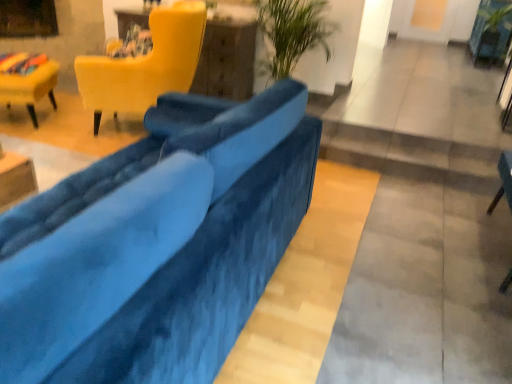
Question: Is green leafy plant at upper right outside of velvet blue chair at lower right, acting as the first chair starting from the right?

Choices:
 (A) yes
 (B) no

Answer: (A)

Question: Can you confirm if green leafy plant at upper right is positioned to the right of velvet blue chair at lower right, acting as the third chair starting from the left?

Choices:
 (A) yes
 (B) no

Answer: (A)

Question: Does green leafy plant at upper right contain velvet blue chair at lower right, acting as the first chair starting from the right?

Choices:
 (A) no
 (B) yes

Answer: (A)

Question: Is green leafy plant at upper right positioned behind velvet blue chair at lower right, acting as the first chair starting from the right?

Choices:
 (A) no
 (B) yes

Answer: (B)

Question: Is green leafy plant at upper right bigger than velvet blue chair at lower right, acting as the first chair starting from the right?

Choices:
 (A) no
 (B) yes

Answer: (B)

Question: Is velvet blue chair at lower right, acting as the third chair starting from the left, spatially inside velvet blue couch at center, or outside of it?

Choices:
 (A) outside
 (B) inside

Answer: (A)

Question: Is velvet blue chair at lower right, acting as the third chair starting from the left, to the left or to the right of velvet blue couch at center in the image?

Choices:
 (A) right
 (B) left

Answer: (A)

Question: Does point tap(490, 206) appear closer or farther from the camera than point tap(166, 336)?

Choices:
 (A) closer
 (B) farther

Answer: (B)

Question: Is velvet blue chair at lower right, acting as the first chair starting from the right, taller or shorter than velvet blue couch at center?

Choices:
 (A) tall
 (B) short

Answer: (B)

Question: In terms of width, does velvet blue couch at center look wider or thinner when compared to velvet yellow chair at left, arranged as the 1th chair when viewed from the left?

Choices:
 (A) wide
 (B) thin

Answer: (A)

Question: Is point (230, 248) positioned closer to the camera than point (11, 86)?

Choices:
 (A) closer
 (B) farther

Answer: (A)

Question: From the image's perspective, is velvet blue couch at center positioned above or below velvet yellow chair at left, arranged as the 1th chair when viewed from the left?

Choices:
 (A) above
 (B) below

Answer: (B)

Question: From a real-world perspective, is velvet blue couch at center physically located above or below velvet yellow chair at left, arranged as the 1th chair when viewed from the left?

Choices:
 (A) below
 (B) above

Answer: (B)

Question: In terms of size, does velvet yellow chair at upper left, which is the second chair from right to left, appear bigger or smaller than velvet yellow chair at left, arranged as the third chair when viewed from the right?

Choices:
 (A) small
 (B) big

Answer: (B)

Question: In the image, is velvet yellow chair at upper left, which is the 2th chair in left-to-right order, positioned in front of or behind velvet yellow chair at left, arranged as the third chair when viewed from the right?

Choices:
 (A) front
 (B) behind

Answer: (A)